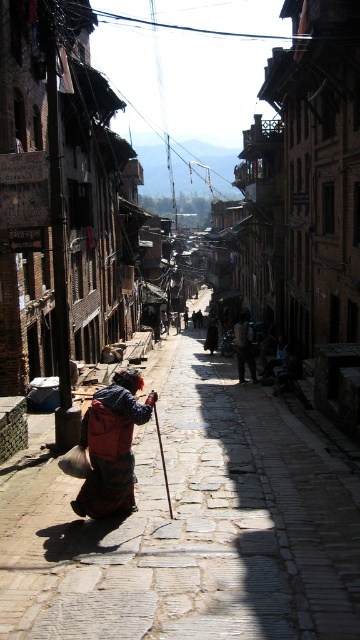
Question: Which object is farther from the camera taking this photo?

Choices:
 (A) red fabric backpack at lower left
 (B) reddish-brown stone alley at center
 (C) dark brown leather jacket at center

Answer: (C)

Question: Which point is closer to the camera taking this photo?

Choices:
 (A) (277, 412)
 (B) (239, 372)

Answer: (A)

Question: Does reddish-brown stone alley at center appear under dark brown leather jacket at center?

Choices:
 (A) no
 (B) yes

Answer: (B)

Question: Can you confirm if reddish-brown stone alley at center is positioned to the left of red fabric backpack at lower left?

Choices:
 (A) yes
 (B) no

Answer: (B)

Question: In this image, where is red fabric backpack at lower left located relative to dark brown leather jacket at center?

Choices:
 (A) above
 (B) below

Answer: (B)

Question: Which of these objects is positioned closest to the dark brown leather jacket at center?

Choices:
 (A) red fabric backpack at lower left
 (B) reddish-brown stone alley at center

Answer: (B)